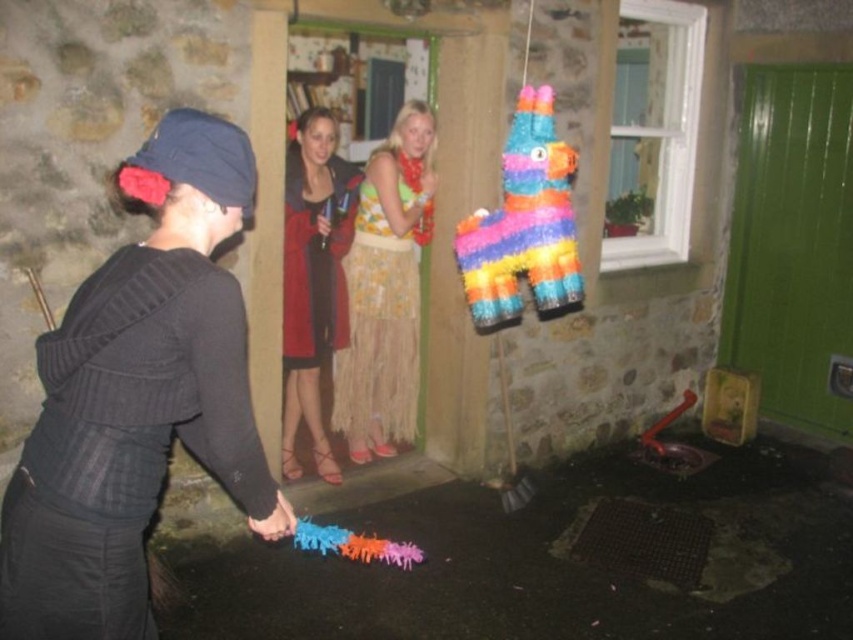
Between floral skirt at center and rainbow paper piñata at center, which one appears on the right side from the viewer's perspective?

rainbow paper piñata at center is more to the right.

Does floral skirt at center have a lesser width compared to rainbow paper piñata at center?

No, floral skirt at center is not thinner than rainbow paper piñata at center.

This screenshot has height=640, width=853. I want to click on floral skirt at center, so click(x=386, y=291).

How much distance is there between red leather jacket at center and rubberized plastic toy at center?

red leather jacket at center and rubberized plastic toy at center are 1.76 meters apart from each other.

Who is more distant from viewer, (320, 264) or (321, 541)?

Positioned behind is point (320, 264).

The width and height of the screenshot is (853, 640). Find the location of `red leather jacket at center`. red leather jacket at center is located at coordinates (312, 278).

Is black knitted sweater at center taller than red leather jacket at center?

No, black knitted sweater at center is not taller than red leather jacket at center.

Describe the element at coordinates (137, 396) in the screenshot. Image resolution: width=853 pixels, height=640 pixels. I see `black knitted sweater at center` at that location.

The width and height of the screenshot is (853, 640). Find the location of `black knitted sweater at center`. black knitted sweater at center is located at coordinates (137, 396).